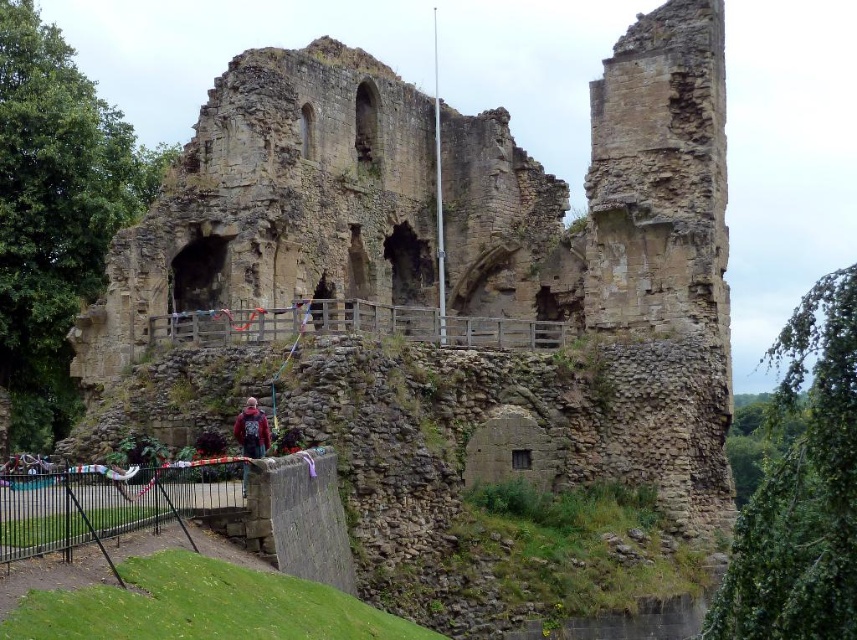
Is brown stone ruins at center to the left of dark red sweater at center from the viewer's perspective?

In fact, brown stone ruins at center is to the right of dark red sweater at center.

The height and width of the screenshot is (640, 857). Describe the element at coordinates (620, 250) in the screenshot. I see `brown stone ruins at center` at that location.

Is point (291, 248) closer to viewer compared to point (261, 422)?

No, it is behind (261, 422).

Identify the location of brown stone ruins at center. (620, 250).